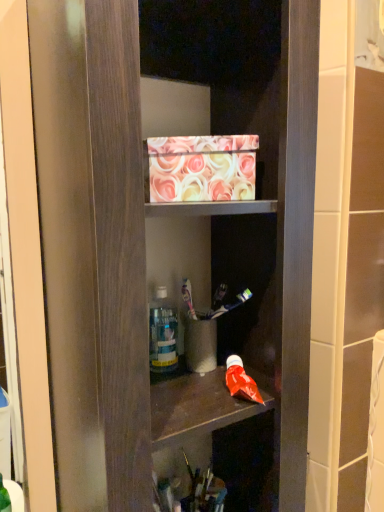
What is the approximate width of floral-patterned cardboard box at upper center?

It is 8.80 inches.

In order to face floral-patterned cardboard box at upper center, should I rotate leftwards or rightwards?

It's best to rotate left around 1.861 degrees.

What do you see at coordinates (202, 168) in the screenshot?
I see `floral-patterned cardboard box at upper center` at bounding box center [202, 168].

The image size is (384, 512). In order to click on floral-patterned cardboard box at upper center in this screenshot , I will do `click(202, 168)`.

Where is `floral-patterned cardboard box at upper center`? The image size is (384, 512). floral-patterned cardboard box at upper center is located at coordinates (202, 168).